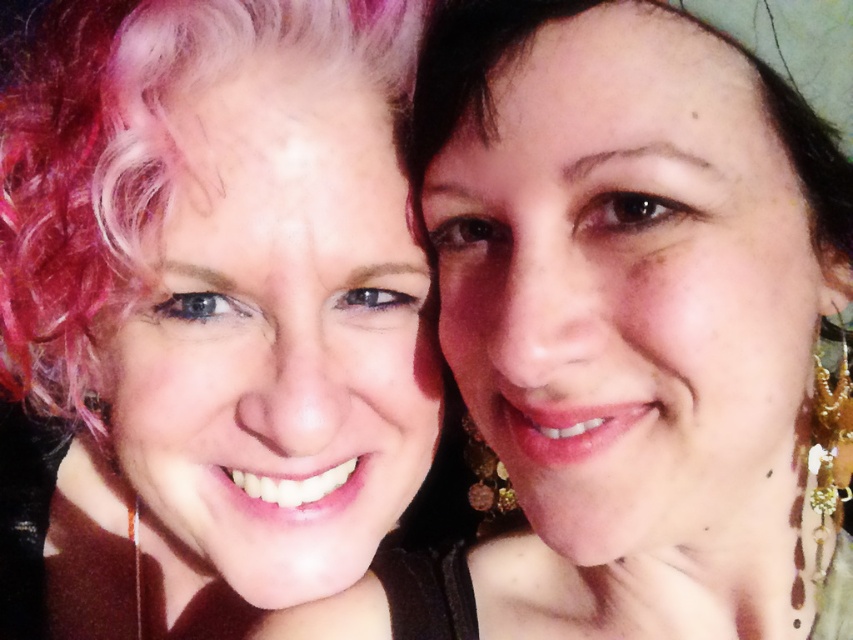
Question: Is matte gold earrings at right behind pink curly hair at center?

Choices:
 (A) yes
 (B) no

Answer: (B)

Question: Which point is farther to the camera?

Choices:
 (A) pink curly hair at center
 (B) matte gold earrings at right

Answer: (A)

Question: Can you confirm if matte gold earrings at right is positioned above pink curly hair at center?

Choices:
 (A) no
 (B) yes

Answer: (A)

Question: Which object appears farthest from the camera in this image?

Choices:
 (A) matte gold earrings at right
 (B) pink curly hair at center

Answer: (B)

Question: Which object appears farthest from the camera in this image?

Choices:
 (A) pink curly hair at center
 (B) matte gold earrings at right

Answer: (A)

Question: Can you confirm if matte gold earrings at right is thinner than pink curly hair at center?

Choices:
 (A) yes
 (B) no

Answer: (A)